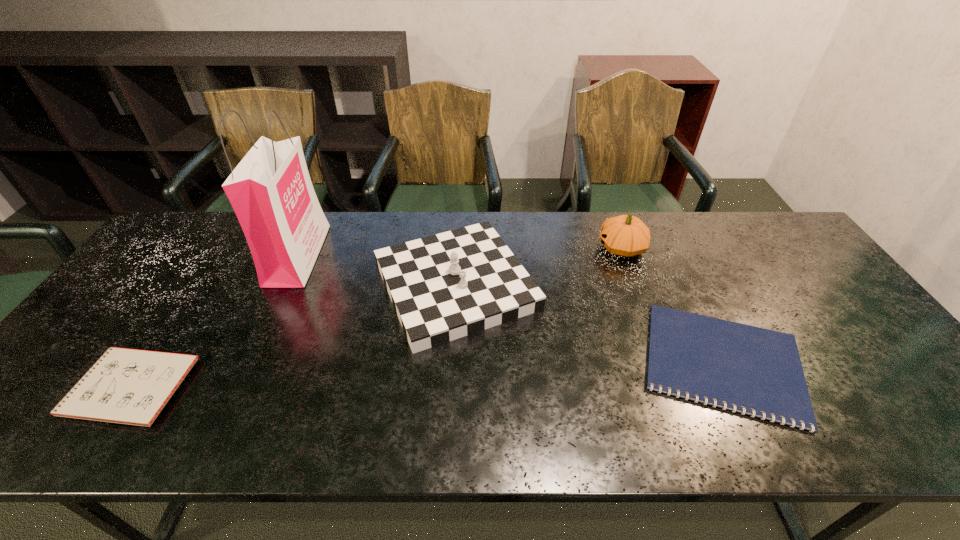
Where is `vacant space at the far edge of the desktop`? The width and height of the screenshot is (960, 540). vacant space at the far edge of the desktop is located at coordinates (465, 222).

Locate an element on the screen. free space at the near edge of the desktop is located at coordinates (684, 416).

Find the location of a particular element. This screenshot has width=960, height=540. blank space at the left edge is located at coordinates (149, 315).

Where is `vacant space at the right edge of the desktop`? This screenshot has width=960, height=540. vacant space at the right edge of the desktop is located at coordinates pos(890,372).

The height and width of the screenshot is (540, 960). In the image, there is a desktop. Identify the location of vacant area at the near left corner. (29, 435).

In order to click on vacant point at the near right corner in this screenshot , I will do `click(905, 426)`.

At what (x,y) coordinates should I click in order to perform the action: click on free space between the shopping bag and the leftmost object. Please return your answer as a coordinate pair (x, y). The height and width of the screenshot is (540, 960). Looking at the image, I should click on (213, 321).

Where is `unoccupied position between the checkerboard and the gourd`? This screenshot has width=960, height=540. unoccupied position between the checkerboard and the gourd is located at coordinates [x=539, y=266].

This screenshot has height=540, width=960. I want to click on vacant point located between the checkerboard and the gourd, so (539, 266).

Locate an element on the screen. The width and height of the screenshot is (960, 540). free spot between the left notepad and the third object from left to right is located at coordinates (292, 336).